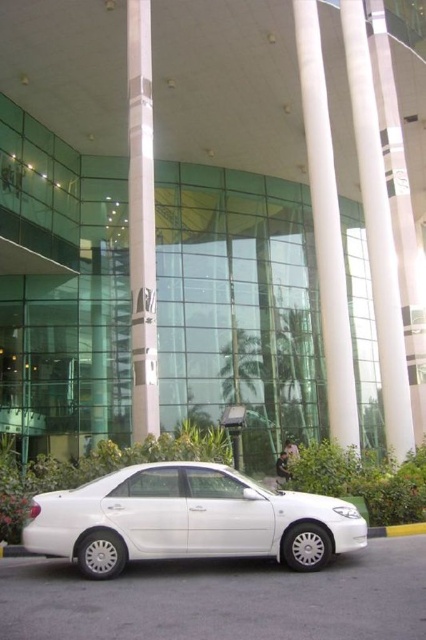
You are a delivery driver approaching the modern building and see the white glossy sedan at lower center and the gray concrete curb at lower right. Which object is closer to the building entrance?

The white glossy sedan at lower center is closer to the building entrance because it is positioned in front of the gray concrete curb at lower right.

You are a driver approaching the building and see the white glossy sedan at lower center and the white glossy pillar at center. Can you park the sedan directly under the pillar without hitting it?

The white glossy sedan at lower center is already positioned under the white glossy pillar at center, so parking it there would not cause any collision.